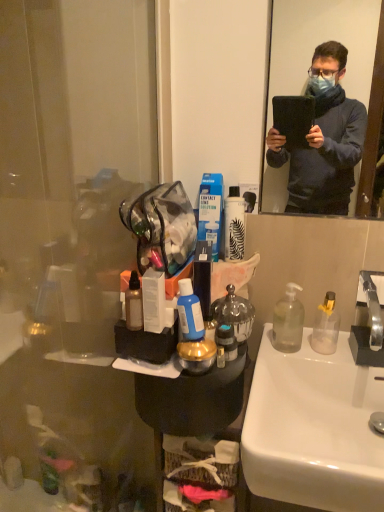
Question: Is translucent plastic bottle at center, which is the first toiletries from right to left, wider or thinner than white glossy sink at lower right?

Choices:
 (A) wide
 (B) thin

Answer: (B)

Question: From the image's perspective, is translucent plastic bottle at center, which is the first toiletries from right to left, located above or below white glossy sink at lower right?

Choices:
 (A) above
 (B) below

Answer: (A)

Question: Estimate the real-world distances between objects in this image. Which object is closer to the white glossy sink at lower right?

Choices:
 (A) translucent plastic bottle at sink, the second bottle in the left-to-right sequence
 (B) metallic fabric handbag at upper left
 (C) silver metallic faucet at right
 (D) clear plastic soap dispenser at right, marked as the first bottle in a left-to-right arrangement
 (E) blue matte bottle at center, which is the 2th toiletries in left-to-right order

Answer: (A)

Question: Which object is the closest to the clear plastic soap dispenser at right, the second bottle in the right-to-left sequence?

Choices:
 (A) metallic silver spray can at center, the 3th toiletries from the right
 (B) metallic fabric handbag at upper left
 (C) white matte spray can at center
 (D) transparent plastic glass door at left
 (E) translucent plastic bottle at sink, which ranks as the first bottle in right-to-left order

Answer: (E)